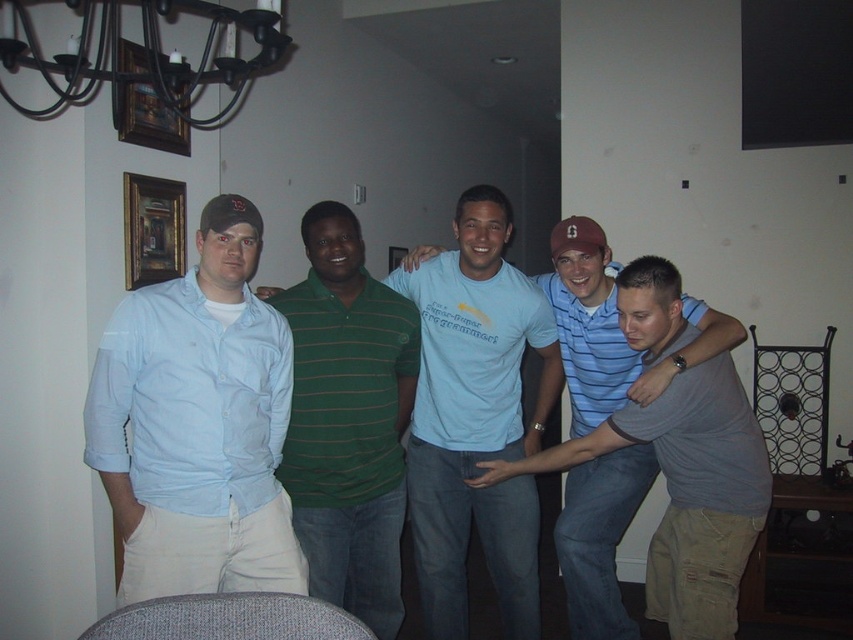
Is light blue cotton shirt at left further to the viewer compared to gray cotton t-shirt at center?

That is False.

Does light blue cotton shirt at left have a lesser height compared to gray cotton t-shirt at center?

Yes.

Between point (236, 378) and point (643, 289), which one is positioned in front?

Point (236, 378) is more forward.

Where is `light blue cotton shirt at left`? The image size is (853, 640). light blue cotton shirt at left is located at coordinates (190, 401).

Measure the distance between gray cotton t-shirt at center and camera.

A distance of 7.25 feet exists between gray cotton t-shirt at center and camera.

Is gray cotton t-shirt at center positioned in front of black wrought iron chandelier at upper left?

No, gray cotton t-shirt at center is further to the viewer.

Between point (722, 392) and point (212, 10), which one is positioned behind?

Point (722, 392)

You are a GUI agent. You are given a task and a screenshot of the screen. Output one action in this format:
    pyautogui.click(x=<x>, y=<y>)
    Task: Click on the gray cotton t-shirt at center
    The height and width of the screenshot is (640, 853).
    Given the screenshot: What is the action you would take?
    pos(676,444)

Is green striped polo shirt at center below light blue cotton t-shirt at center?

Correct, green striped polo shirt at center is located below light blue cotton t-shirt at center.

Is green striped polo shirt at center taller than light blue cotton t-shirt at center?

Yes, green striped polo shirt at center is taller than light blue cotton t-shirt at center.

Is point (352, 529) closer to camera compared to point (485, 378)?

Yes.

I want to click on green striped polo shirt at center, so click(x=347, y=419).